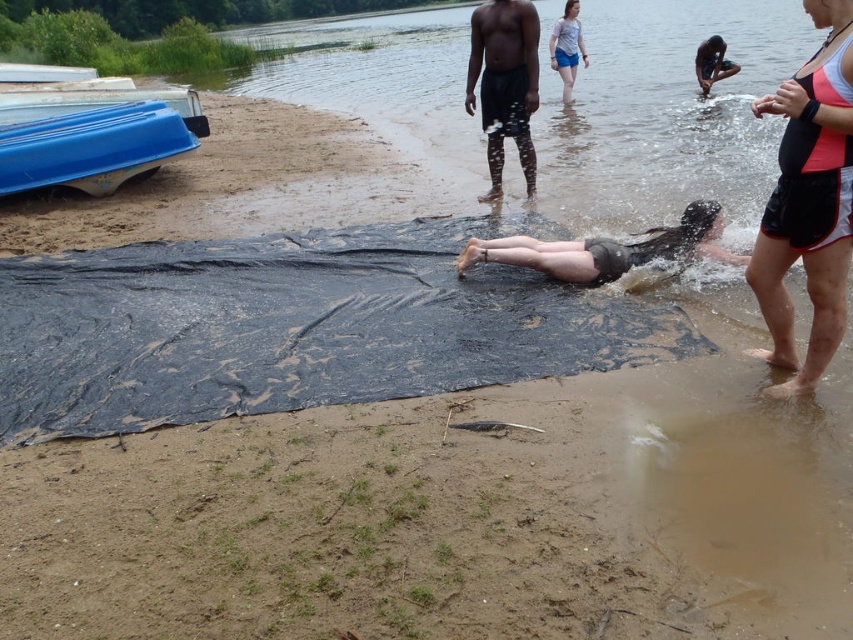
You are a photographer at the lakeside scene. You need to capture a photo that includes both the black matte shorts at lower right and the dark skin human at upper right. Which object should be placed closer to the camera to ensure both are fully visible in the frame?

The black matte shorts at lower right is much taller than the dark skin human at upper right, so to ensure both are fully visible in the frame, the dark skin human at upper right should be placed closer to the camera.

You are a lifeguard on duty at the lakeside. A swimmer is in trouble near the light blue denim shorts at upper center. To reach them quickly, in which direction should you swim from your current position at the lifeguard tower located at point 0.0,0.0?

The light blue denim shorts at upper center is located at point (x=567, y=48). Since the lifeguard tower is at (x=0, y=0), you should swim northeast to reach the light blue denim shorts at upper center.

Based on the photo, you are a photographer at the lakeside scene. You want to capture a photo where both the light blue denim shorts at upper center and the dark skin human at upper right are visible. Which object should be placed closer to the camera to ensure both are in frame?

The light blue denim shorts at upper center has a lesser height compared to dark skin human at upper right, so placing the light blue denim shorts at upper center closer to the camera will ensure both are visible in the photo.